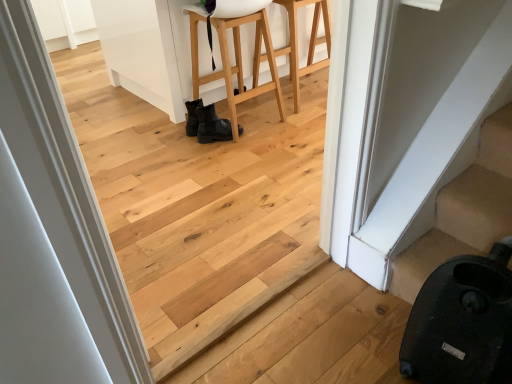
Question: In the image, is black matte boots at center on the left side or the right side of black leather boots at center, the 2th furniture viewed from the right?

Choices:
 (A) left
 (B) right

Answer: (A)

Question: Considering the positions of point (206, 125) and point (238, 29), is point (206, 125) closer or farther from the camera than point (238, 29)?

Choices:
 (A) farther
 (B) closer

Answer: (B)

Question: Which of these objects is positioned closest to the natural wood stool at center, acting as the 2th furniture starting from the left?

Choices:
 (A) black matte boots at center
 (B) white smooth door at left
 (C) black leather boots at center, the 2th furniture viewed from the right

Answer: (C)

Question: Estimate the real-world distances between objects in this image. Which object is closer to the black leather boots at center, the 2th furniture viewed from the right?

Choices:
 (A) natural wood stool at center, acting as the 2th furniture starting from the left
 (B) black matte boots at center
 (C) white smooth door at left

Answer: (A)